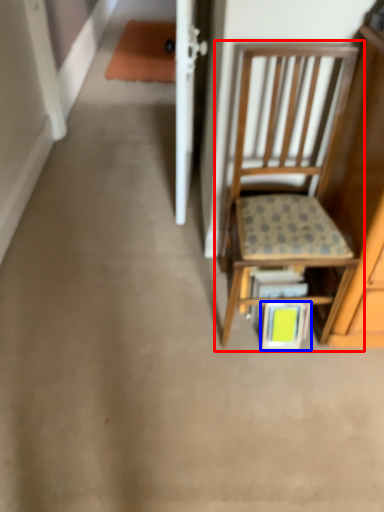
Question: Which point is closer to the camera, chair (highlighted by a red box) or book (highlighted by a blue box)?

Choices:
 (A) chair
 (B) book

Answer: (A)